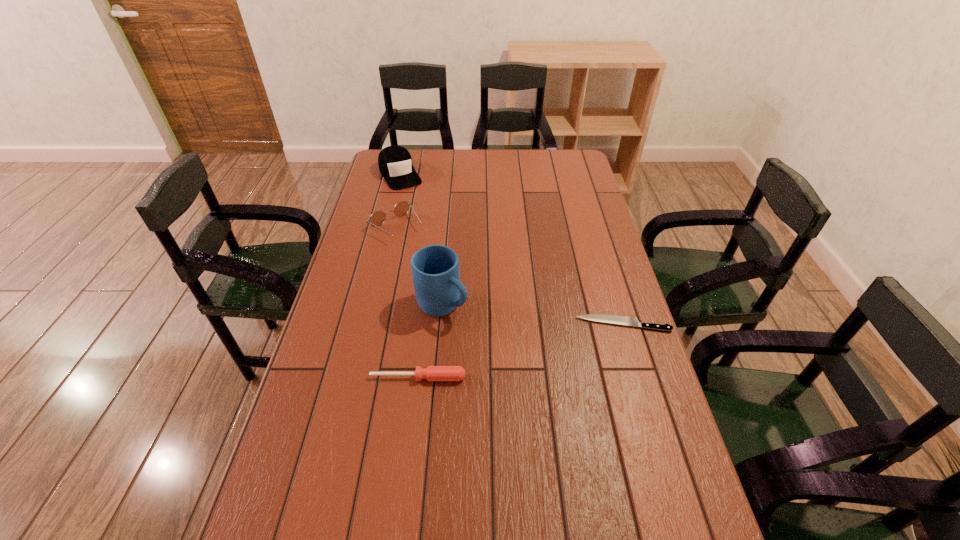
What are the coordinates of `vacant area situated 0.290m on the back of the steak knife` in the screenshot? It's located at (601, 253).

The height and width of the screenshot is (540, 960). What are the coordinates of `free space located on the front-facing side of the second tallest object` in the screenshot? It's located at (434, 233).

In order to click on vacant point located on the front-facing side of the second tallest object in this screenshot , I will do `click(431, 228)`.

At what (x,y) coordinates should I click in order to perform the action: click on vacant space situated 0.230m on the front-facing side of the second tallest object. Please return your answer as a coordinate pair (x, y). Looking at the image, I should click on click(426, 219).

Find the location of a particular element. The image size is (960, 540). vacant area located 0.240m on the front-facing side of the second farthest object is located at coordinates (450, 278).

Find the location of a particular element. vacant space located 0.160m on the front-facing side of the second farthest object is located at coordinates (436, 265).

Where is `vacant space located on the front-facing side of the second farthest object`? vacant space located on the front-facing side of the second farthest object is located at coordinates (465, 292).

What are the coordinates of `vacant space located 0.180m on the side of the mug with the handle` in the screenshot? It's located at (506, 353).

Identify the location of vacant region located 0.200m on the side of the mug with the handle. (511, 357).

The width and height of the screenshot is (960, 540). I want to click on free space located on the side of the mug with the handle, so click(x=509, y=355).